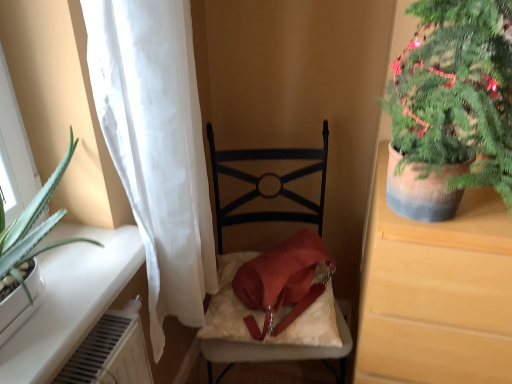
Question: Is white sheer curtain at left to the right of matte brown cabinet at right from the viewer's perspective?

Choices:
 (A) no
 (B) yes

Answer: (A)

Question: Is matte brown cabinet at right located within white sheer curtain at left?

Choices:
 (A) no
 (B) yes

Answer: (A)

Question: From the image's perspective, would you say white sheer curtain at left is shown under matte brown cabinet at right?

Choices:
 (A) no
 (B) yes

Answer: (A)

Question: Does white sheer curtain at left have a larger size compared to matte brown cabinet at right?

Choices:
 (A) no
 (B) yes

Answer: (A)

Question: From a real-world perspective, is white sheer curtain at left positioned over matte brown cabinet at right based on gravity?

Choices:
 (A) yes
 (B) no

Answer: (A)

Question: Looking at the image, does velvet-like white pillow at center seem bigger or smaller compared to matte black chair at center?

Choices:
 (A) big
 (B) small

Answer: (B)

Question: Is velvet-like white pillow at center inside or outside of matte black chair at center?

Choices:
 (A) outside
 (B) inside

Answer: (B)

Question: In terms of width, does velvet-like white pillow at center look wider or thinner when compared to matte black chair at center?

Choices:
 (A) thin
 (B) wide

Answer: (A)

Question: In the image, is velvet-like white pillow at center on the left side or the right side of matte black chair at center?

Choices:
 (A) right
 (B) left

Answer: (B)

Question: From a real-world perspective, relative to green textured plant at upper right, is matte brown cabinet at right vertically above or below?

Choices:
 (A) above
 (B) below

Answer: (B)

Question: Based on their sizes in the image, would you say matte brown cabinet at right is bigger or smaller than green textured plant at upper right?

Choices:
 (A) big
 (B) small

Answer: (A)

Question: Relative to green textured plant at upper right, is matte brown cabinet at right in front or behind?

Choices:
 (A) behind
 (B) front

Answer: (A)

Question: From the image's perspective, is matte brown cabinet at right positioned above or below green textured plant at upper right?

Choices:
 (A) above
 (B) below

Answer: (B)

Question: Relative to matte brown cabinet at right, is green textured plant at upper right in front or behind?

Choices:
 (A) front
 (B) behind

Answer: (A)

Question: Is point (476, 148) closer or farther from the camera than point (390, 354)?

Choices:
 (A) closer
 (B) farther

Answer: (A)